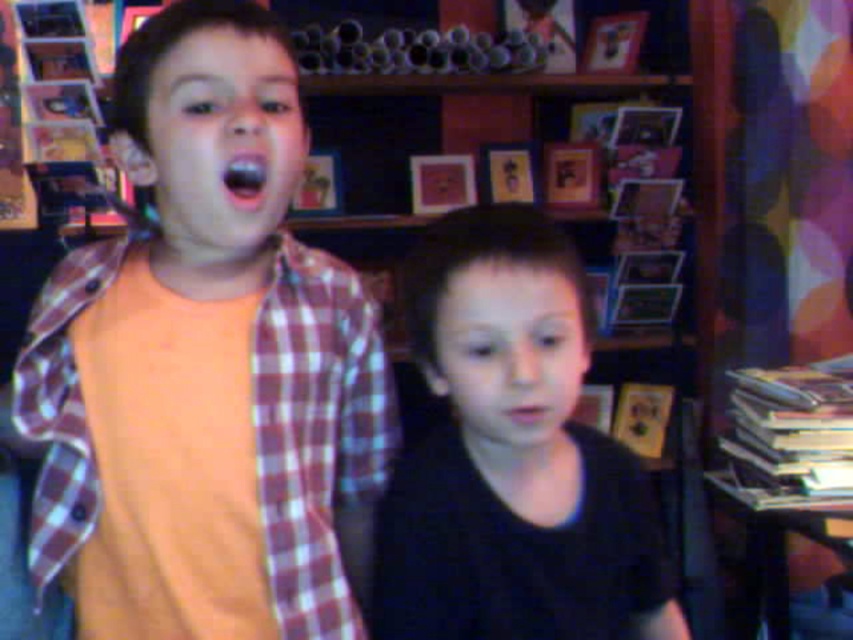
Is black matte shirt at center positioned behind orange cotton shirt at left?

No.

Is black matte shirt at center thinner than orange cotton shirt at left?

Indeed, black matte shirt at center has a lesser width compared to orange cotton shirt at left.

The height and width of the screenshot is (640, 853). Identify the location of black matte shirt at center. (512, 456).

What are the coordinates of `black matte shirt at center` in the screenshot? It's located at (512, 456).